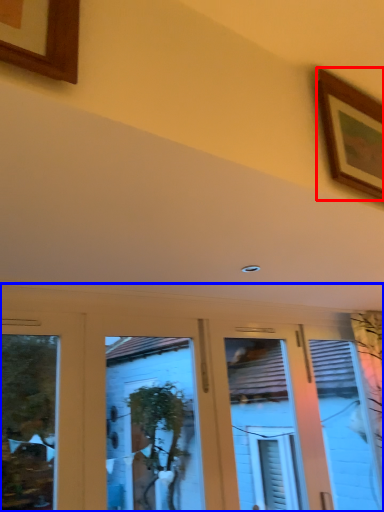
Question: Which point is closer to the camera, picture frame (highlighted by a red box) or hotel lobby (highlighted by a blue box)?

Choices:
 (A) picture frame
 (B) hotel lobby

Answer: (A)